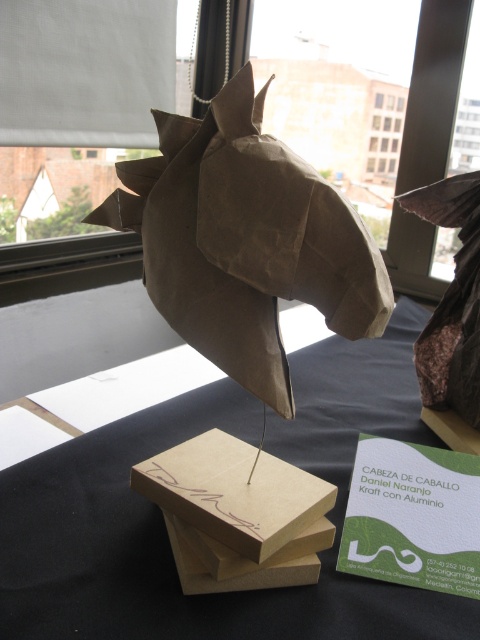
Which is in front, point (261, 180) or point (358, 544)?

Point (261, 180) is more forward.

Is the position of brown kraft paper horse head at center less distant than that of green kraft at center?

That is True.

Is point (225, 362) positioned behind point (452, 484)?

No, (225, 362) is closer to viewer.

Locate an element on the screen. This screenshot has width=480, height=640. brown kraft paper horse head at center is located at coordinates (244, 241).

Can you confirm if brown kraft paper horse head at center is positioned above brown kraft at center?

Indeed, brown kraft paper horse head at center is positioned over brown kraft at center.

The width and height of the screenshot is (480, 640). I want to click on brown kraft paper horse head at center, so click(x=244, y=241).

Between point (180, 179) and point (228, 502), which one is positioned behind?

The point (228, 502) is behind.

You are a GUI agent. You are given a task and a screenshot of the screen. Output one action in this format:
    pyautogui.click(x=<x>, y=<y>)
    Task: Click on the brown kraft paper horse head at center
    
    Given the screenshot: What is the action you would take?
    pyautogui.click(x=244, y=241)

Measure the distance between matte brown paper at center and camera.

A distance of 16.38 inches exists between matte brown paper at center and camera.

Locate an element on the screen. The width and height of the screenshot is (480, 640). matte brown paper at center is located at coordinates (165, 529).